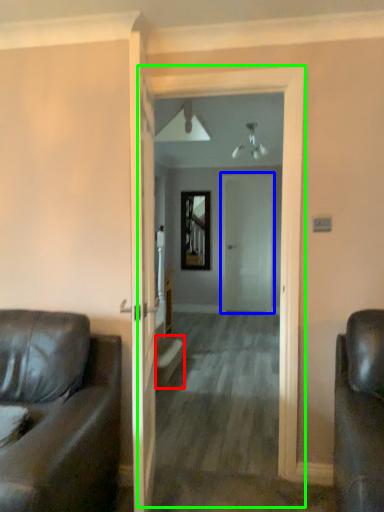
Question: Which object is the farthest from stairwell (highlighted by a red box)? Choose among these: door (highlighted by a blue box) or corridor (highlighted by a green box).

Choices:
 (A) door
 (B) corridor

Answer: (A)